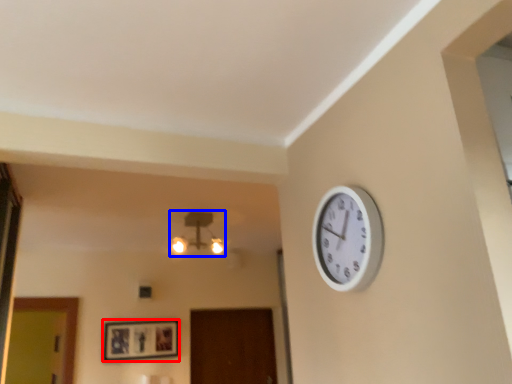
Question: Among these objects, which one is nearest to the camera, picture frame (highlighted by a red box) or lamp (highlighted by a blue box)?

Choices:
 (A) picture frame
 (B) lamp

Answer: (B)